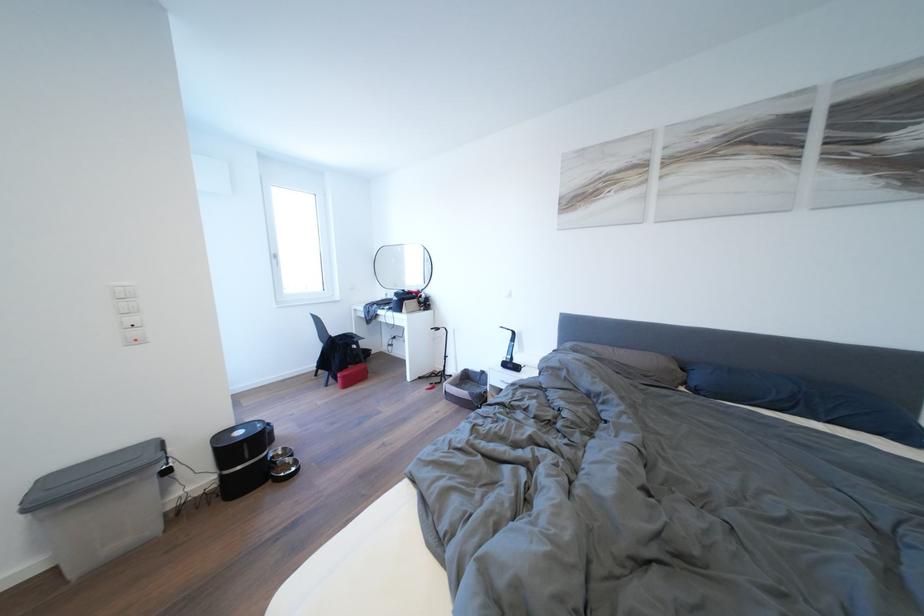
Find where to lift the black pet feeder. Please return your answer as a coordinate pair (x, y).

(240, 458)